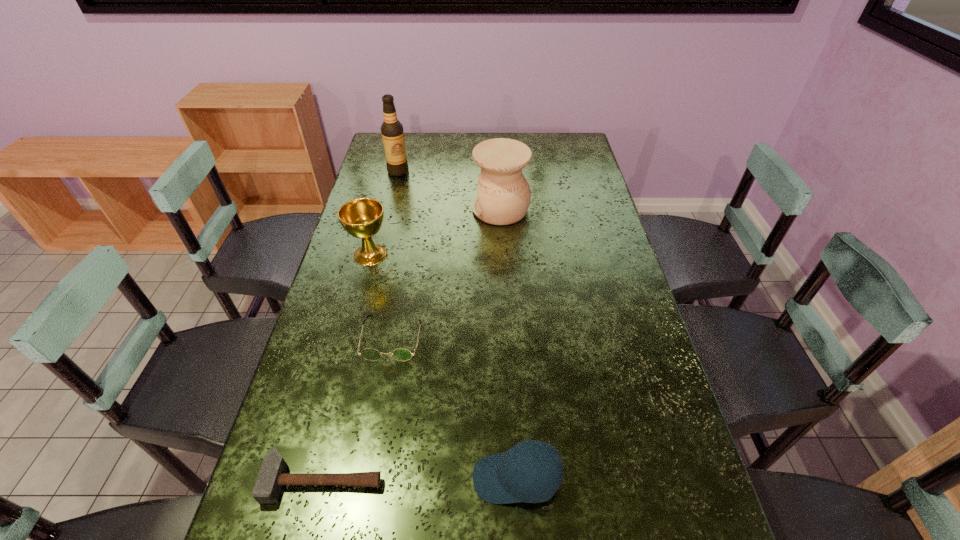
You are a GUI agent. You are given a task and a screenshot of the screen. Output one action in this format:
    pyautogui.click(x=<x>, y=<y>)
    Task: Click on the free space located 0.270m on the label of the tallest object
    
    Given the screenshot: What is the action you would take?
    pyautogui.click(x=387, y=219)

I want to click on free space located 0.350m at the open side of the fifth shortest object, so click(374, 210).

Find the location of a particular element. The height and width of the screenshot is (540, 960). vacant space situated at the open side of the fifth shortest object is located at coordinates (430, 210).

Where is `free space located at the open side of the fifth shortest object`? free space located at the open side of the fifth shortest object is located at coordinates (402, 210).

This screenshot has height=540, width=960. I want to click on free spot located 0.170m on the front of the chalice, so [356, 310].

This screenshot has height=540, width=960. Identify the location of free space located 0.070m on the front-facing side of the third shortest object. pos(440,478).

Locate an element on the screen. The width and height of the screenshot is (960, 540). free spot located on the front-facing side of the third shortest object is located at coordinates (348, 478).

Image resolution: width=960 pixels, height=540 pixels. I want to click on vacant area situated 0.380m on the front-facing side of the third shortest object, so click(x=291, y=478).

Locate an element on the screen. free space located on the lenses of the second shortest object is located at coordinates (377, 422).

Where is `vacant space located on the striking surface of the hammer`? Image resolution: width=960 pixels, height=540 pixels. vacant space located on the striking surface of the hammer is located at coordinates (309, 538).